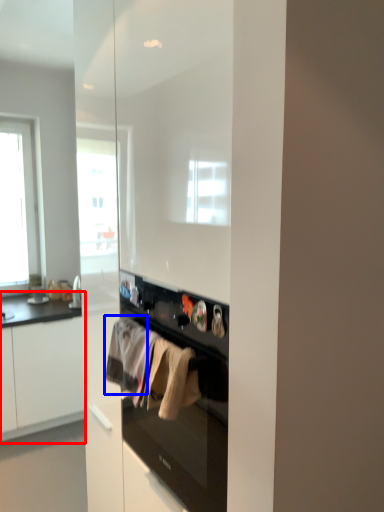
Question: Among these objects, which one is nearest to the camera, cabinetry (highlighted by a red box) or clothing (highlighted by a blue box)?

Choices:
 (A) cabinetry
 (B) clothing

Answer: (B)